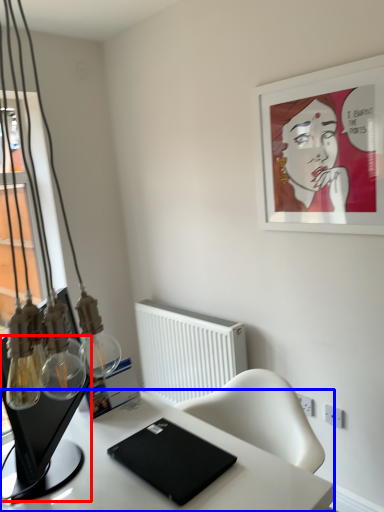
Question: Which object is further to the camera taking this photo, computer monitor (highlighted by a red box) or desk (highlighted by a blue box)?

Choices:
 (A) computer monitor
 (B) desk

Answer: (B)